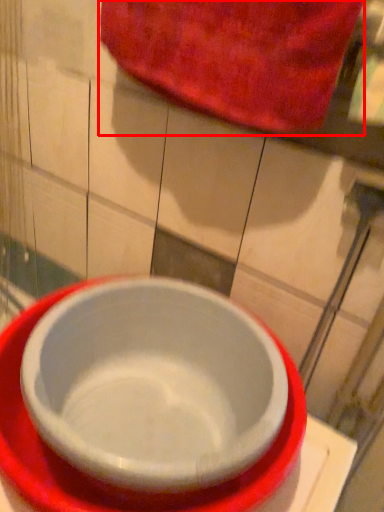
Question: From the image's perspective, where is beach towel (annotated by the red box) located relative to bowl?

Choices:
 (A) below
 (B) above

Answer: (B)